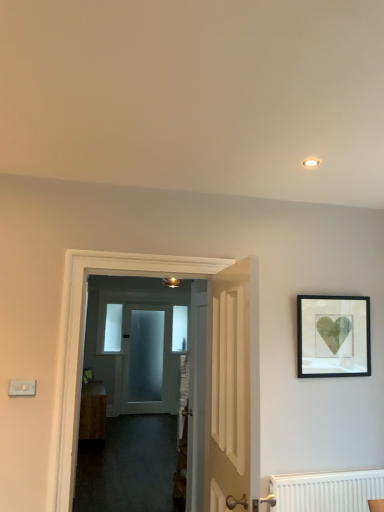
Question: Should I look upward or downward to see white wooden door at center, the 1th door when ordered from front to back?

Choices:
 (A) down
 (B) up

Answer: (A)

Question: From the image's perspective, is white wooden door at center, which is the 3th door from back to front, under white plastic light switch at lower left?

Choices:
 (A) no
 (B) yes

Answer: (B)

Question: Does white wooden door at center, the 1th door when ordered from front to back, appear on the left side of white plastic light switch at lower left?

Choices:
 (A) no
 (B) yes

Answer: (A)

Question: Is white wooden door at center, which is the 3th door from back to front, next to white plastic light switch at lower left?

Choices:
 (A) no
 (B) yes

Answer: (A)

Question: Considering the relative positions of white wooden door at center, which is the 3th door from back to front, and white plastic light switch at lower left in the image provided, is white wooden door at center, which is the 3th door from back to front, to the right of white plastic light switch at lower left from the viewer's perspective?

Choices:
 (A) yes
 (B) no

Answer: (A)

Question: Can you confirm if white wooden door at center, which is the 3th door from back to front, is smaller than white plastic light switch at lower left?

Choices:
 (A) no
 (B) yes

Answer: (A)

Question: Considering the relative sizes of white wooden door at center, the 1th door when ordered from front to back, and white plastic light switch at lower left in the image provided, is white wooden door at center, the 1th door when ordered from front to back, taller than white plastic light switch at lower left?

Choices:
 (A) yes
 (B) no

Answer: (A)

Question: Is clear glass door at center, the first window from the front, positioned in front of frosted glass door at center, placed as the 3th door when sorted from front to back?

Choices:
 (A) no
 (B) yes

Answer: (A)

Question: From the image's perspective, is clear glass door at center, which ranks as the first window in left-to-right order, located beneath frosted glass door at center, placed as the 3th door when sorted from front to back?

Choices:
 (A) yes
 (B) no

Answer: (B)

Question: Can we say clear glass door at center, the first window from the front, lies outside frosted glass door at center, the 1th door when ordered from back to front?

Choices:
 (A) no
 (B) yes

Answer: (B)

Question: Considering the relative sizes of clear glass door at center, which ranks as the first window in left-to-right order, and frosted glass door at center, placed as the 3th door when sorted from front to back, in the image provided, is clear glass door at center, which ranks as the first window in left-to-right order, smaller than frosted glass door at center, placed as the 3th door when sorted from front to back,?

Choices:
 (A) no
 (B) yes

Answer: (B)

Question: Considering the relative sizes of clear glass door at center, the 2th window when ordered from right to left, and frosted glass door at center, the 1th door when ordered from back to front, in the image provided, is clear glass door at center, the 2th window when ordered from right to left, shorter than frosted glass door at center, the 1th door when ordered from back to front,?

Choices:
 (A) yes
 (B) no

Answer: (A)

Question: Is clear glass door at center, the first window from the front, not near frosted glass door at center, the 1th door when ordered from back to front?

Choices:
 (A) no
 (B) yes

Answer: (A)

Question: Is wooden cabinet at center smaller than white wooden door at center, which is the 3th door from back to front?

Choices:
 (A) no
 (B) yes

Answer: (A)